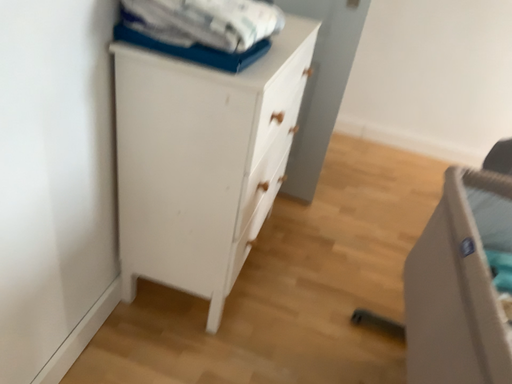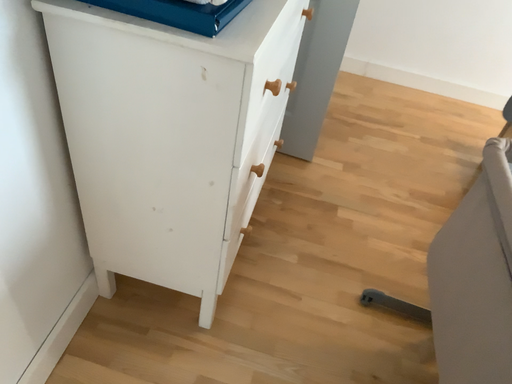
Question: How did the camera likely rotate when shooting the video?

Choices:
 (A) rotated upward
 (B) rotated downward

Answer: (B)